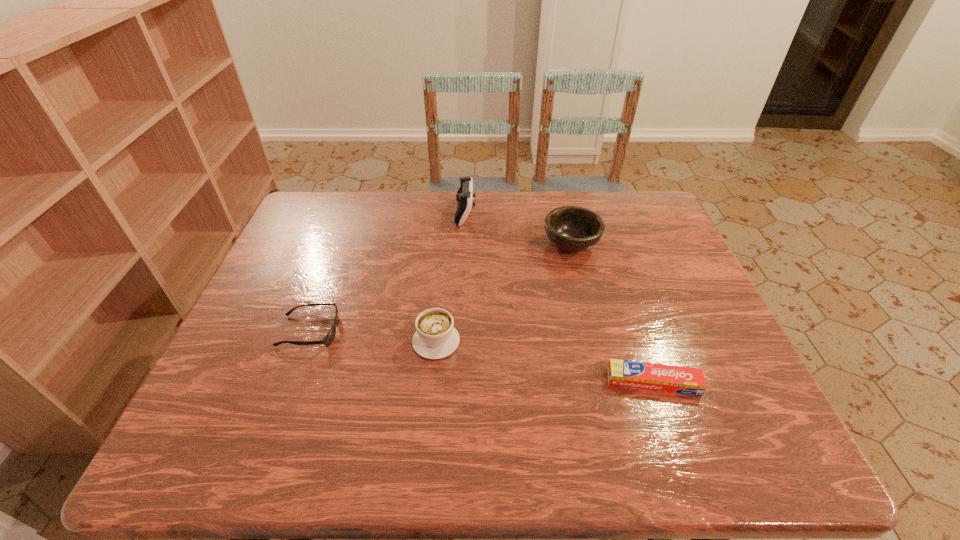
Identify the location of free space at the far right corner of the desktop. (651, 201).

Where is `free space that is in between the cappuccino and the tallest object`? free space that is in between the cappuccino and the tallest object is located at coordinates (451, 276).

Find the location of `empty space that is in between the tallest object and the cappuccino`. empty space that is in between the tallest object and the cappuccino is located at coordinates (451, 276).

Image resolution: width=960 pixels, height=540 pixels. What are the coordinates of `free space between the bowl and the cappuccino` in the screenshot? It's located at (504, 292).

Locate an element on the screen. vacant space in between the bowl and the tallest object is located at coordinates (518, 228).

Where is `free spot between the cappuccino and the leftmost object`? The image size is (960, 540). free spot between the cappuccino and the leftmost object is located at coordinates (372, 336).

The width and height of the screenshot is (960, 540). Identify the location of vacant region between the bowl and the cappuccino. (504, 292).

Locate an element on the screen. free space between the sunglasses and the tallest object is located at coordinates (388, 272).

Where is `vacant area between the bowl and the sunglasses`? The width and height of the screenshot is (960, 540). vacant area between the bowl and the sunglasses is located at coordinates (441, 288).

This screenshot has width=960, height=540. Identify the location of free area in between the bowl and the cappuccino. (504, 292).